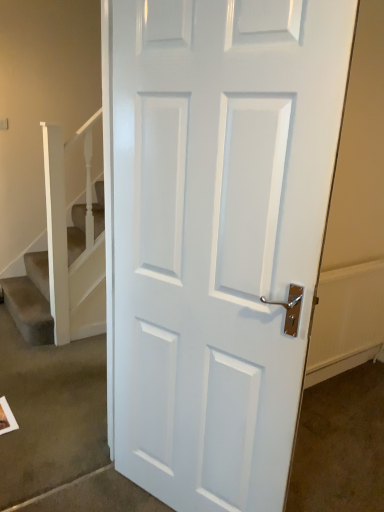
At what (x,y) coordinates should I click in order to perform the action: click on white glossy door at center. Please return your answer as a coordinate pair (x, y). This screenshot has height=512, width=384. Looking at the image, I should click on (216, 234).

This screenshot has width=384, height=512. What do you see at coordinates (216, 234) in the screenshot?
I see `white glossy door at center` at bounding box center [216, 234].

Locate an element on the screen. The image size is (384, 512). white glossy door at center is located at coordinates (216, 234).